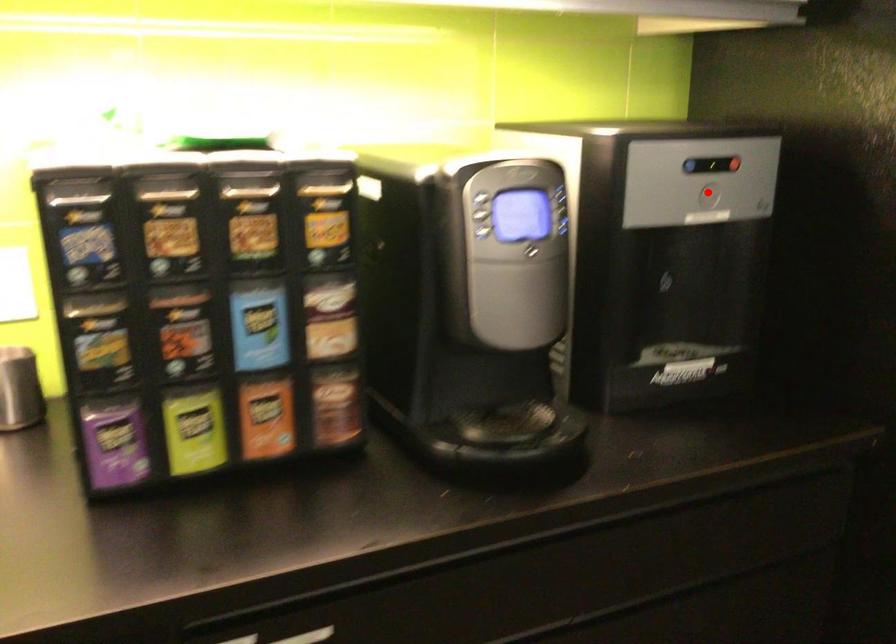
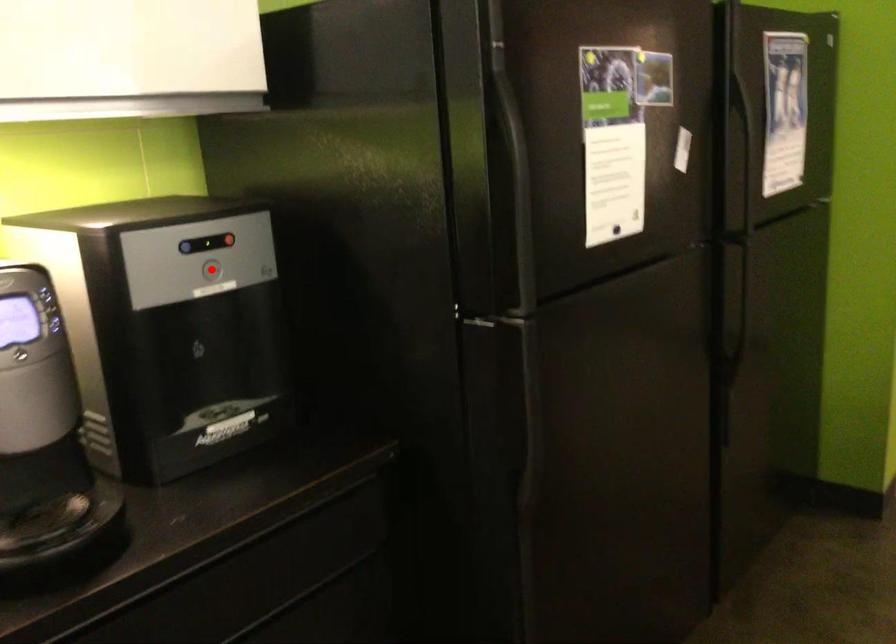
I am providing you with two images of the same scene from different viewpoints. A red point is marked on the first image and another point is marked on the second image. Does the point marked in image1 correspond to the same location as the one in image2?

Yes